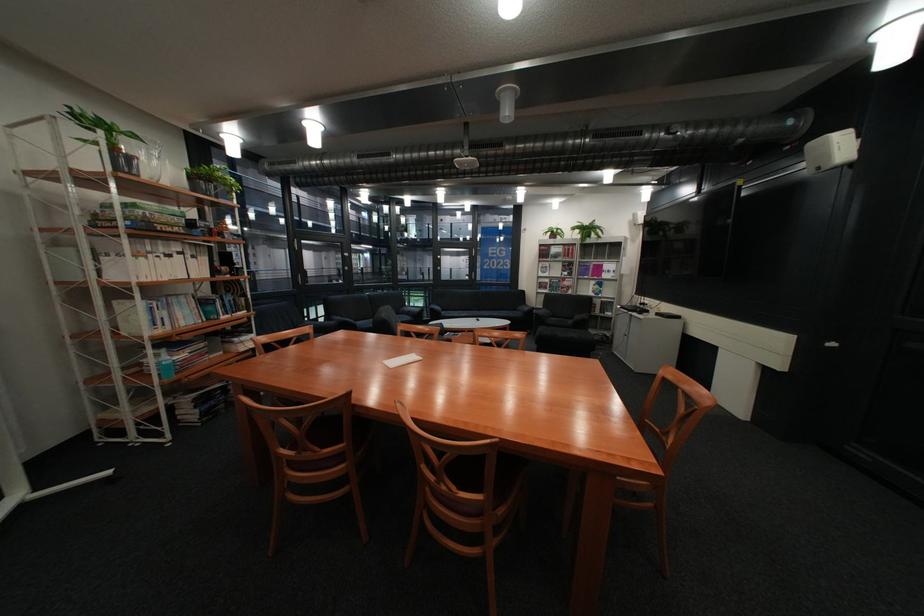
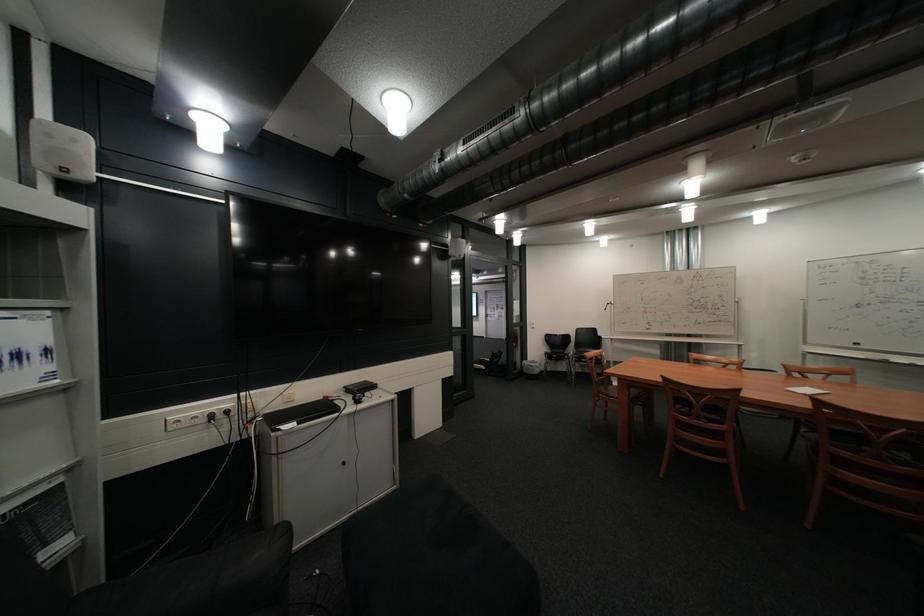
In the second image, find the point that corresponds to pixel 625 278 in the first image.

(46, 386)